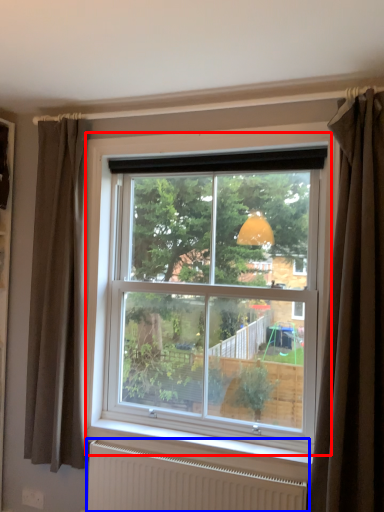
Question: Which of the following is the farthest to the observer, window (highlighted by a red box) or radiator (highlighted by a blue box)?

Choices:
 (A) window
 (B) radiator

Answer: (A)